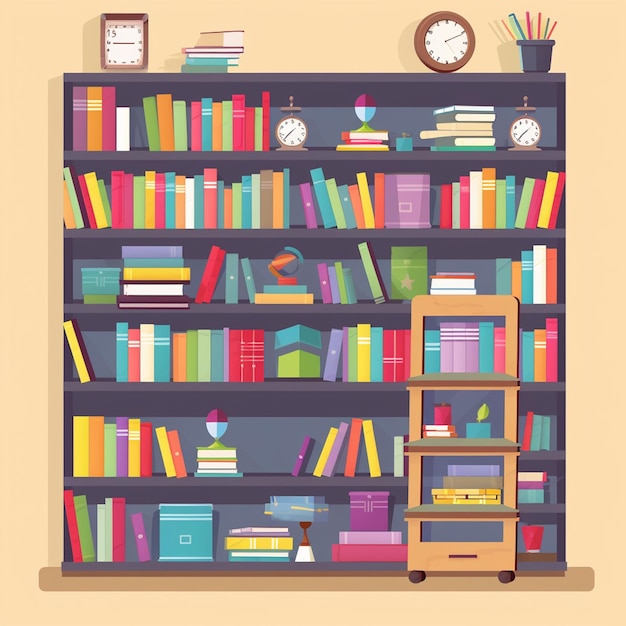
In order to click on pens in gray cup in this screenshot , I will do `click(551, 26)`, `click(545, 28)`, `click(538, 29)`, `click(529, 26)`, `click(518, 24)`, `click(514, 24)`, `click(510, 33)`.